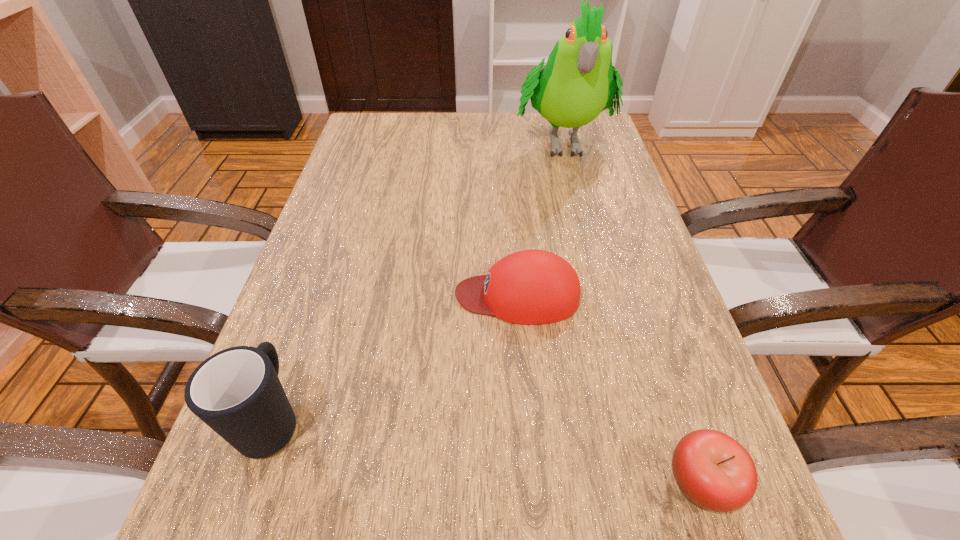
At what (x,y) coordinates should I click in order to perform the action: click on vacant space at the left edge of the desktop. Please return your answer as a coordinate pair (x, y). The width and height of the screenshot is (960, 540). Looking at the image, I should click on (353, 167).

The image size is (960, 540). Identify the location of vacant space at the right edge of the desktop. (653, 328).

Locate an element on the screen. This screenshot has height=540, width=960. free spot at the far left corner of the desktop is located at coordinates (380, 112).

In the image, there is a desktop. Where is `free space at the far right corner`? Image resolution: width=960 pixels, height=540 pixels. free space at the far right corner is located at coordinates (591, 132).

Identify the location of vacant area that lies between the baseball cap and the apple. (610, 389).

Locate an element on the screen. The width and height of the screenshot is (960, 540). unoccupied area between the apple and the mug is located at coordinates (487, 450).

I want to click on vacant region between the apple and the mug, so click(487, 450).

At what (x,y) coordinates should I click in order to perform the action: click on free point between the apple and the mug. Please return your answer as a coordinate pair (x, y). Image resolution: width=960 pixels, height=540 pixels. Looking at the image, I should click on (487, 450).

Identify the location of unoccupied area between the third shortest object and the parakeet. The width and height of the screenshot is (960, 540). (418, 280).

The height and width of the screenshot is (540, 960). I want to click on empty space that is in between the third shortest object and the third nearest object, so click(x=396, y=356).